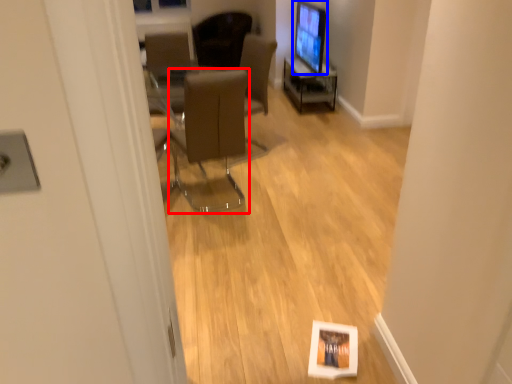
Question: Which point is closer to the camera, chair (highlighted by a red box) or computer monitor (highlighted by a blue box)?

Choices:
 (A) chair
 (B) computer monitor

Answer: (A)